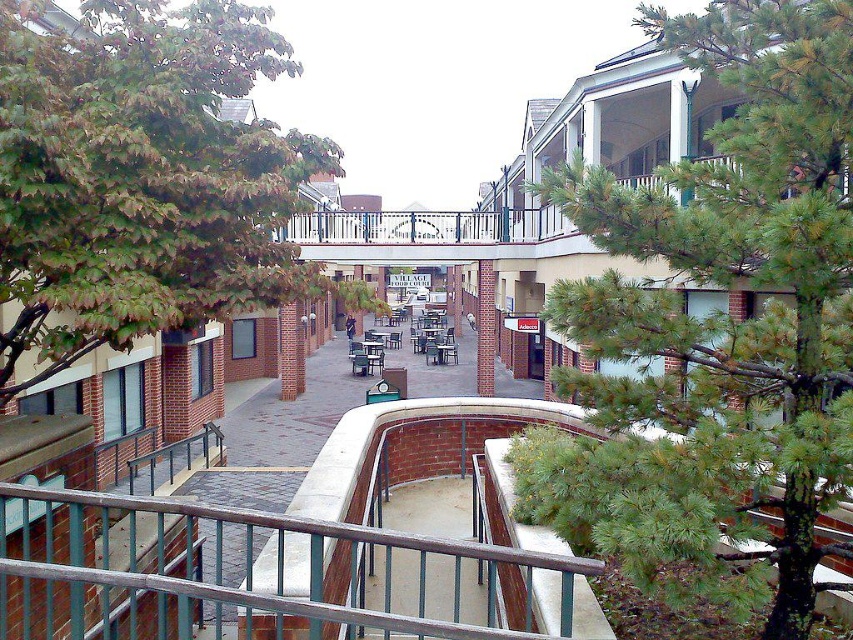
Question: Among these objects, which one is farthest from the camera?

Choices:
 (A) metallic gray railing at center
 (B) green leafy tree at left
 (C) green pine tree at upper right

Answer: (A)

Question: Is green pine tree at upper right wider than green leafy tree at left?

Choices:
 (A) no
 (B) yes

Answer: (A)

Question: Does green pine tree at upper right come behind metallic gray railing at center?

Choices:
 (A) no
 (B) yes

Answer: (A)

Question: Which object is farther from the camera taking this photo?

Choices:
 (A) metallic gray railing at center
 (B) green leafy tree at left
 (C) green pine tree at upper right

Answer: (A)

Question: Which point is closer to the camera taking this photo?

Choices:
 (A) (223, 611)
 (B) (73, 344)

Answer: (B)

Question: Observing the image, what is the correct spatial positioning of green leafy tree at left in reference to metallic gray railing at center?

Choices:
 (A) below
 (B) above

Answer: (B)